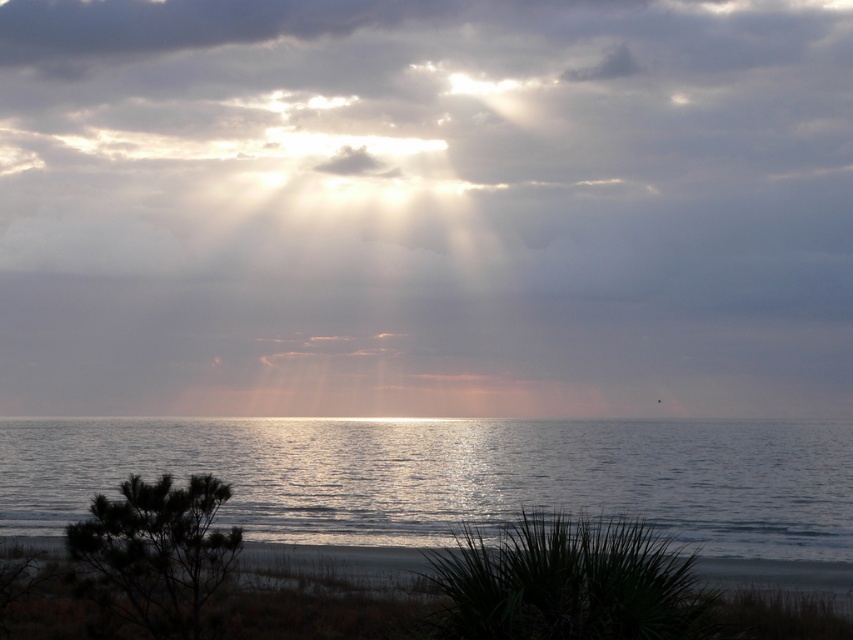
Can you confirm if cloudy at upper center is positioned below glistening water at lower center?

Actually, cloudy at upper center is above glistening water at lower center.

Between cloudy at upper center and glistening water at lower center, which one is positioned higher?

cloudy at upper center is above.

The width and height of the screenshot is (853, 640). What do you see at coordinates (425, 208) in the screenshot?
I see `cloudy at upper center` at bounding box center [425, 208].

Where is `cloudy at upper center`? cloudy at upper center is located at coordinates (425, 208).

Which is below, cloudy at upper center or dark sand at lower center?

dark sand at lower center is lower down.

Image resolution: width=853 pixels, height=640 pixels. Describe the element at coordinates (425, 208) in the screenshot. I see `cloudy at upper center` at that location.

The image size is (853, 640). Identify the location of cloudy at upper center. (425, 208).

From the picture: Which of these two, glistening water at lower center or dark sand at lower center, stands taller?

Standing taller between the two is glistening water at lower center.

Measure the distance between point (212, 420) and camera.

Point (212, 420) and camera are 172.27 meters apart.

Where is `glistening water at lower center`? glistening water at lower center is located at coordinates (454, 476).